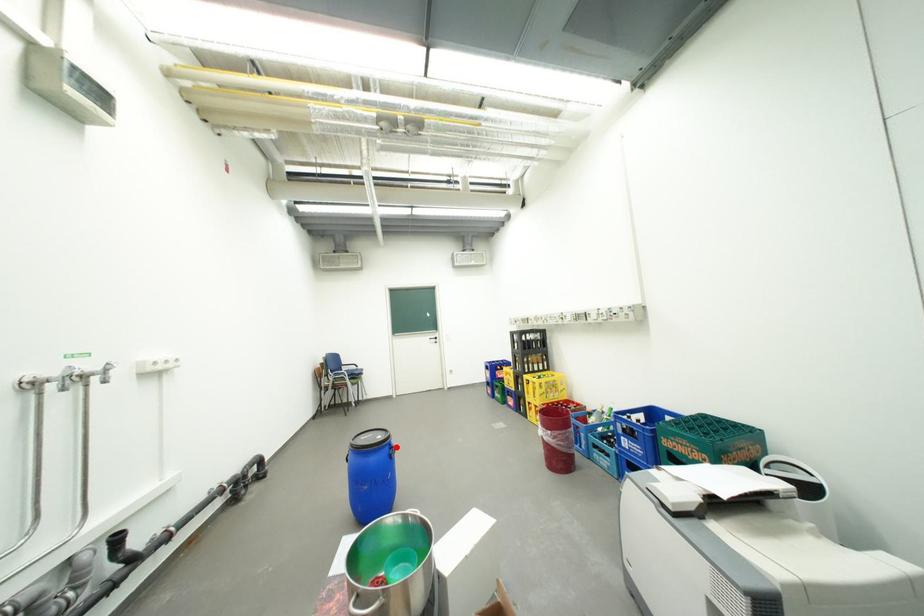
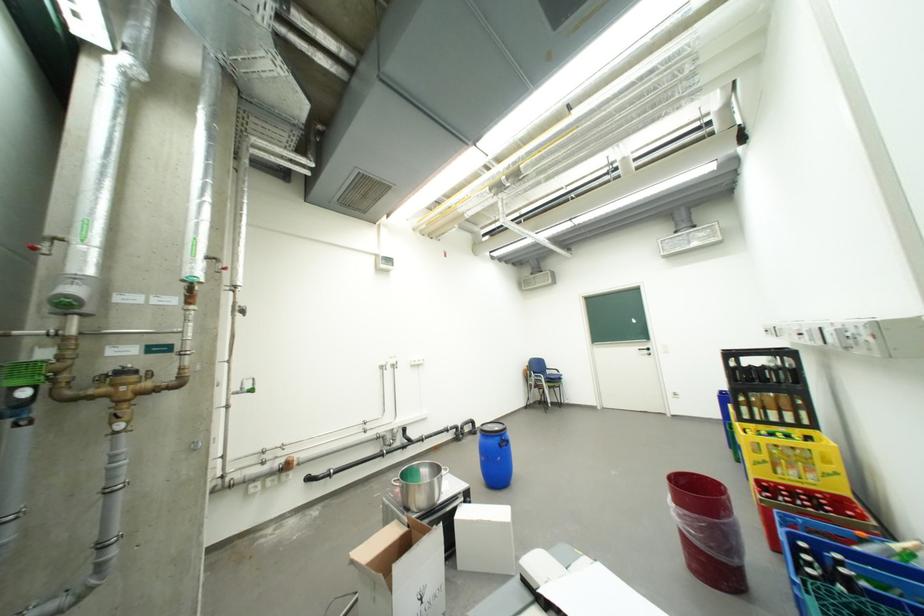
Locate, in the second image, the point that corresponds to the highlighted location in the first image.

(507, 438)